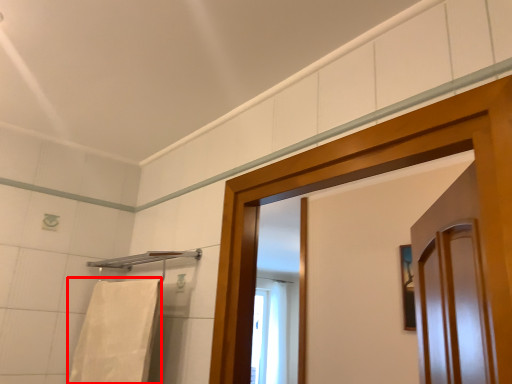
Question: From the image's perspective, what is the correct spatial positioning of bath towel (annotated by the red box) in reference to towel bar?

Choices:
 (A) below
 (B) above

Answer: (A)